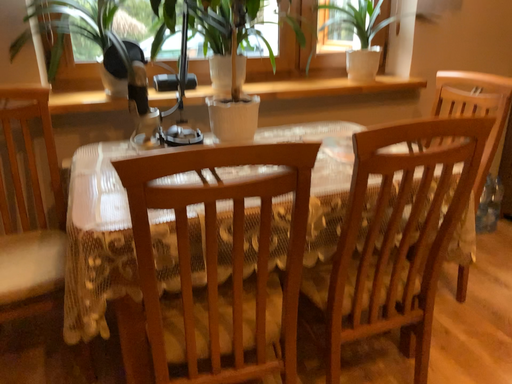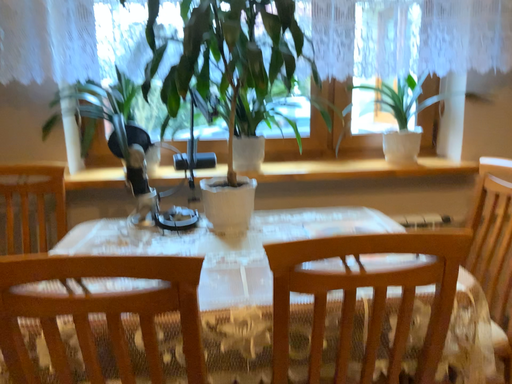
Question: Which way did the camera rotate in the video?

Choices:
 (A) rotated downward
 (B) rotated upward

Answer: (B)